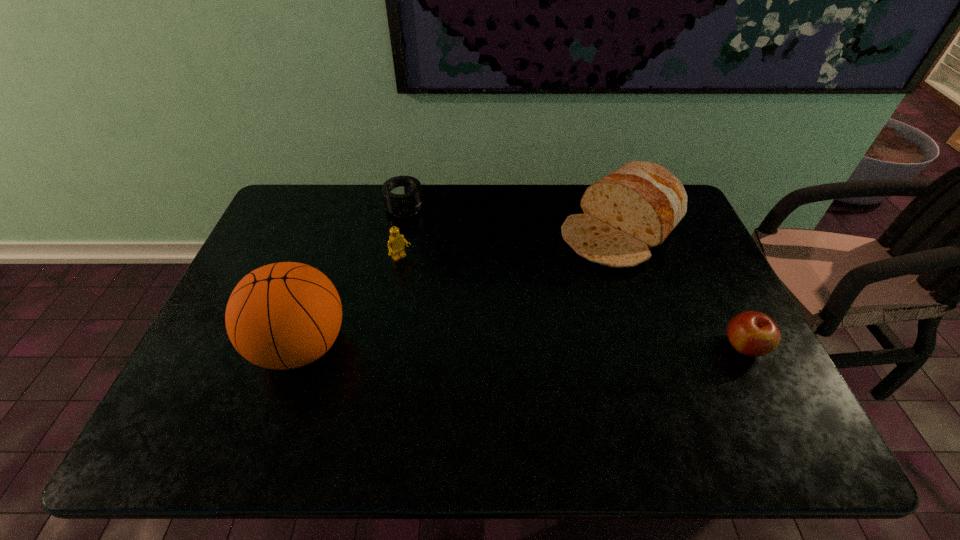
You are a GUI agent. You are given a task and a screenshot of the screen. Output one action in this format:
    pyautogui.click(x=<x>, y=<y>)
    Task: Click on the free space located at the sliced end of the fourth shortest object
    
    Given the screenshot: What is the action you would take?
    pyautogui.click(x=573, y=271)

You are a GUI agent. You are given a task and a screenshot of the screen. Output one action in this format:
    pyautogui.click(x=<x>, y=<y>)
    Task: Click on the free space located at the sliced end of the fourth shortest object
    The height and width of the screenshot is (540, 960).
    Given the screenshot: What is the action you would take?
    pyautogui.click(x=543, y=298)

Locate an element on the screen. The width and height of the screenshot is (960, 540). free space located at the sliced end of the fourth shortest object is located at coordinates (540, 301).

Locate an element on the screen. This screenshot has height=540, width=960. vacant position located on the face of the Lego is located at coordinates (476, 334).

I want to click on free space located 0.080m on the face of the Lego, so click(x=421, y=279).

Image resolution: width=960 pixels, height=540 pixels. I want to click on free spot located 0.250m on the face of the Lego, so click(x=458, y=315).

Find the location of `telephoto lens situated at the far edge`. telephoto lens situated at the far edge is located at coordinates (402, 195).

Identify the location of bread positioned at the far edge. (634, 208).

Locate an element on the screen. Image resolution: width=960 pixels, height=540 pixels. object that is positioned at the near edge is located at coordinates (285, 315).

Locate an element on the screen. Image resolution: width=960 pixels, height=540 pixels. object that is at the left edge is located at coordinates (285, 315).